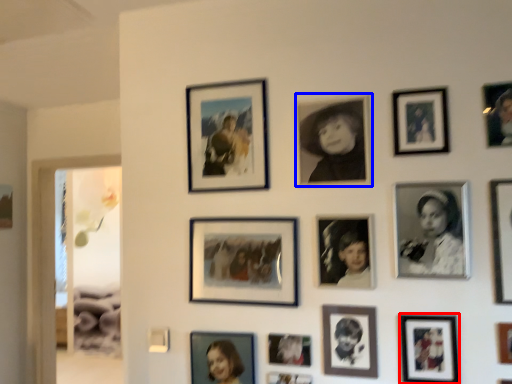
Question: Which point is further to the camera, picture frame (highlighted by a red box) or picture frame (highlighted by a blue box)?

Choices:
 (A) picture frame
 (B) picture frame

Answer: (B)